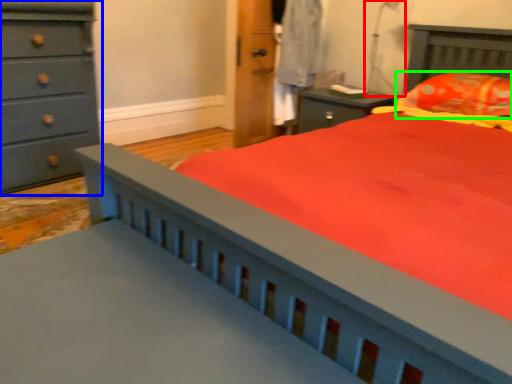
Question: Which is farther away from table lamp (highlighted by a red box)? chest of drawers (highlighted by a blue box) or pillow (highlighted by a green box)?

Choices:
 (A) chest of drawers
 (B) pillow

Answer: (A)